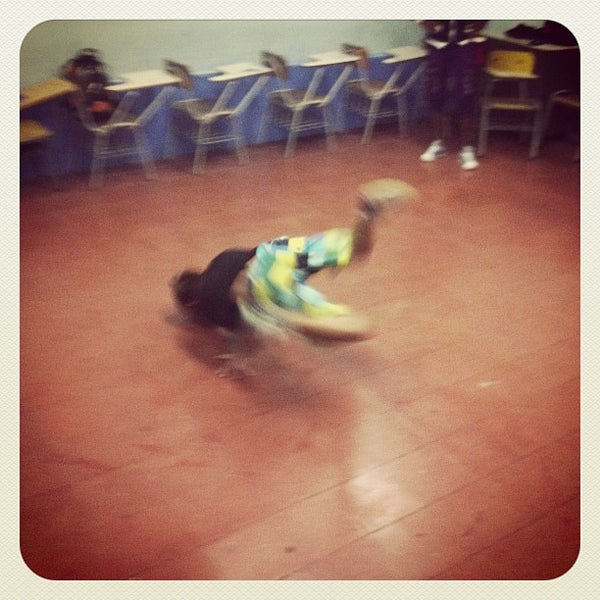
You are a GUI agent. You are given a task and a screenshot of the screen. Output one action in this format:
    pyautogui.click(x=<x>, y=<y>)
    Task: Click on the image frame inner corners
    
    Given the screenshot: What is the action you would take?
    pyautogui.click(x=29, y=567), pyautogui.click(x=573, y=565), pyautogui.click(x=571, y=31), pyautogui.click(x=31, y=29)